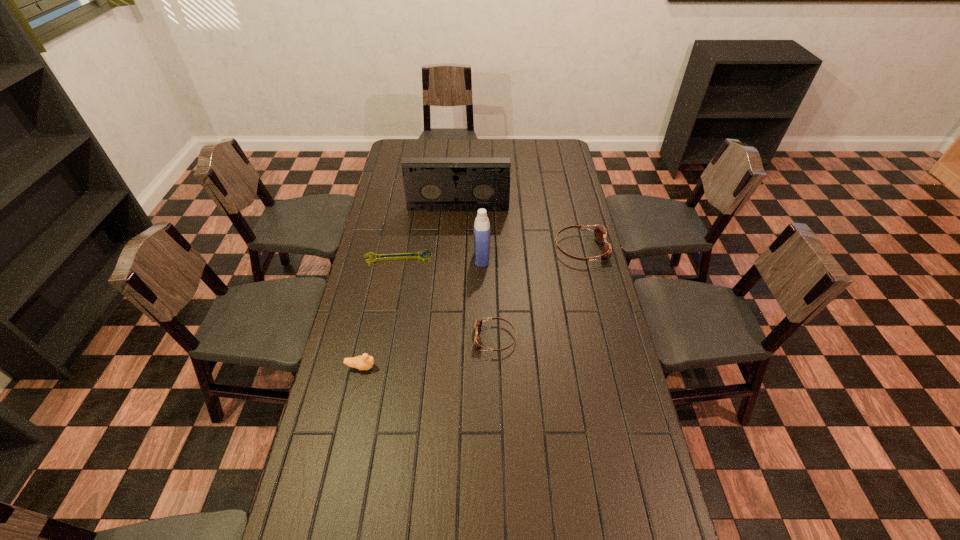
The height and width of the screenshot is (540, 960). I want to click on free spot between the second nearest object and the right goggles, so click(x=538, y=293).

This screenshot has height=540, width=960. Identify the location of empty location between the farthest object and the shortest object. (428, 233).

Where is `unoccupied area between the wrench and the nearest object`? The width and height of the screenshot is (960, 540). unoccupied area between the wrench and the nearest object is located at coordinates (380, 312).

Locate an element on the screen. This screenshot has width=960, height=540. free space between the wrench and the duckling is located at coordinates (380, 312).

The height and width of the screenshot is (540, 960). What are the coordinates of `vacant area that lies between the shortest object and the farthest object` in the screenshot? It's located at (428, 233).

Identify which object is located as the third nearest to the detergent. Please provide its 2D coordinates. Your answer should be formatted as a tuple, i.e. [(x, y)], where the tuple contains the x and y coordinates of a point satisfying the conditions above.

[(600, 234)]

In order to click on the fourth closest object relative to the shortest object in this screenshot , I will do `click(365, 362)`.